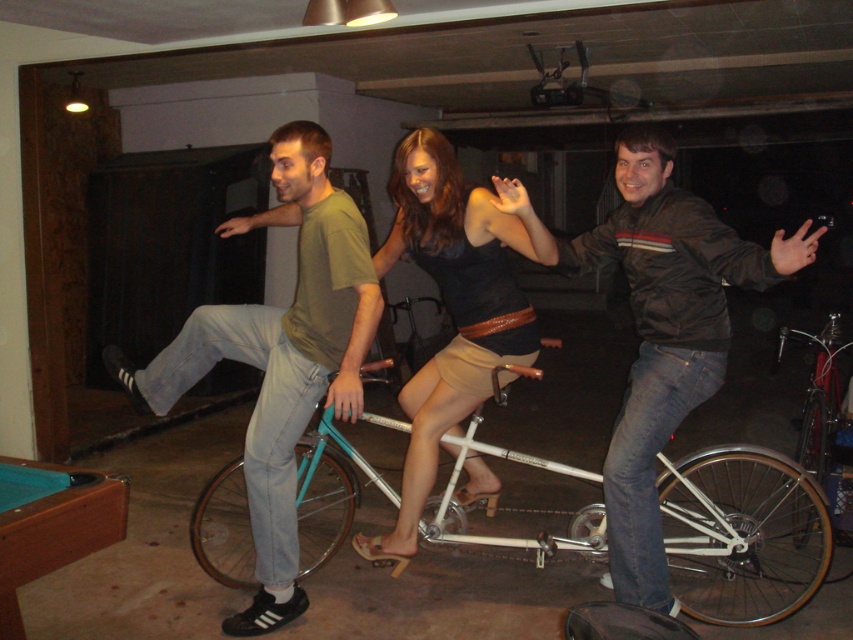
Question: Is matte green t-shirt at center wider than dark brown leather jacket at center?

Choices:
 (A) no
 (B) yes

Answer: (B)

Question: Among these objects, which one is nearest to the camera?

Choices:
 (A) matte green t-shirt at center
 (B) white metallic bicycle at center
 (C) blue felt pool table at lower left

Answer: (C)

Question: Which point is farther to the camera?

Choices:
 (A) (820, 378)
 (B) (521, 209)
 (C) (329, 372)
 (D) (325, 525)

Answer: (A)

Question: Does dark brown leather jacket at center have a greater width compared to matte black tank top at center?

Choices:
 (A) no
 (B) yes

Answer: (A)

Question: Which object is the farthest from the silver metallic bicycle at center?

Choices:
 (A) matte black tank top at center
 (B) dark brown leather jacket at center

Answer: (A)

Question: From the image, what is the correct spatial relationship of matte green t-shirt at center in relation to dark brown leather jacket at center?

Choices:
 (A) left
 (B) right

Answer: (A)